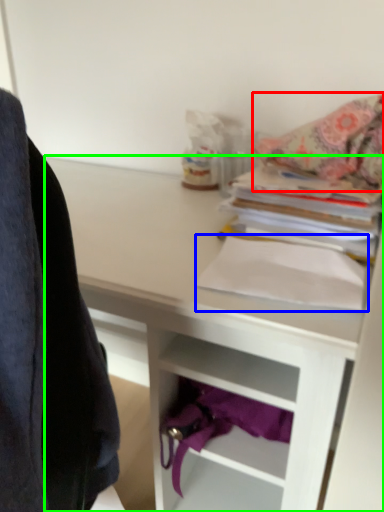
Question: Which object is positioned closest to blanket (highlighted by a red box)? Select from paperback book (highlighted by a blue box) and desk (highlighted by a green box).

Choices:
 (A) paperback book
 (B) desk

Answer: (A)